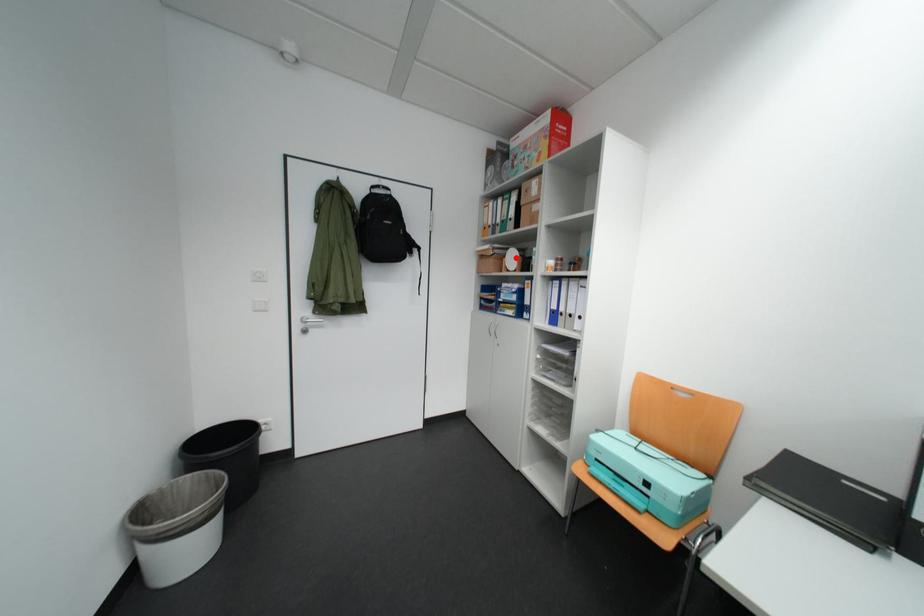
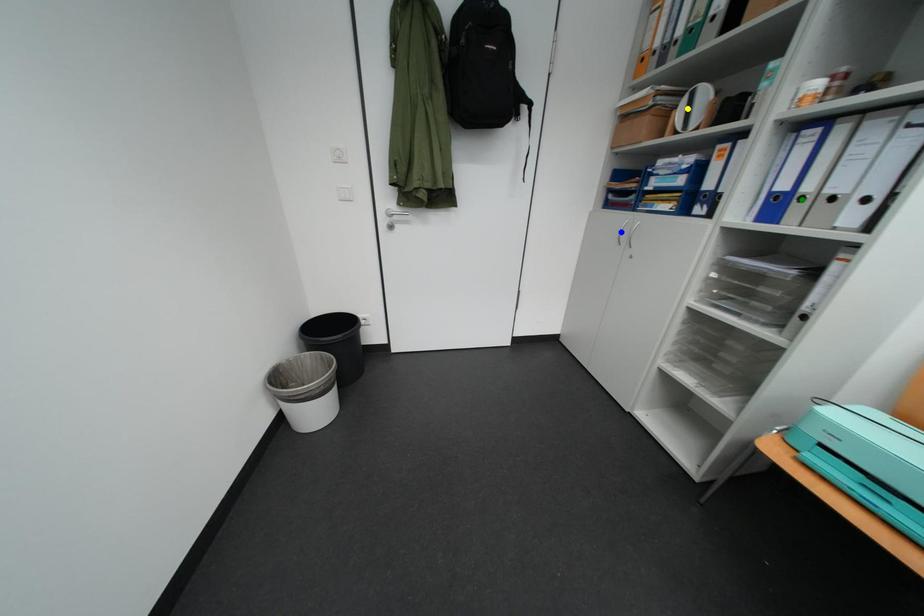
Question: I am providing you with two images of the same scene from different viewpoints. A red point is marked on the first image. You are given multiple points on the second image. Which point in image 2 represents the same 3d spot as the red point in image 1?

Choices:
 (A) green point
 (B) blue point
 (C) yellow point

Answer: (C)